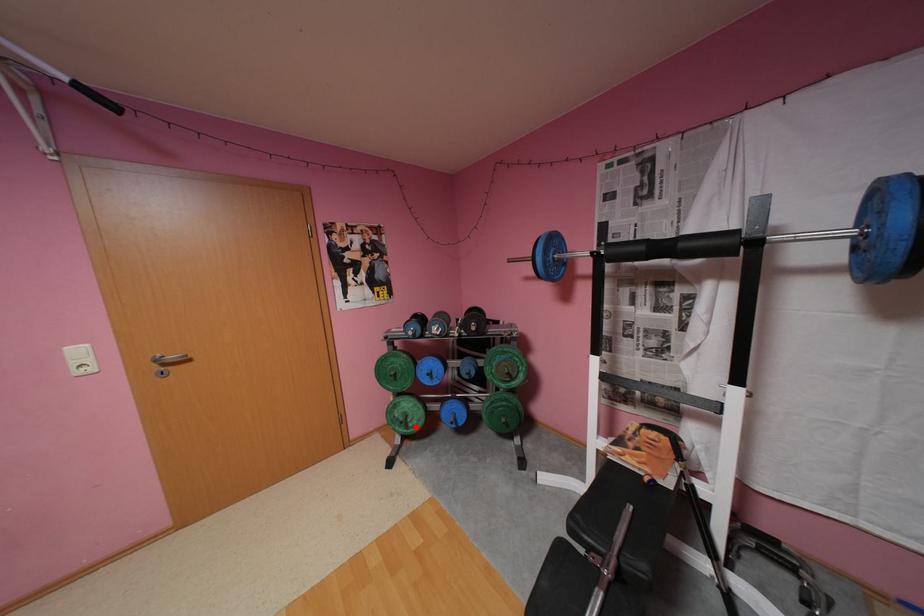
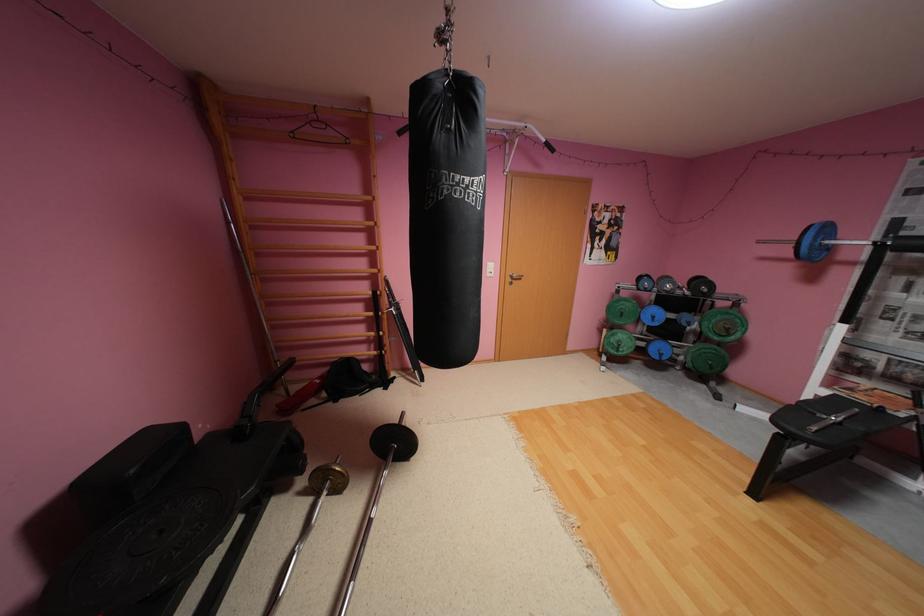
Question: I am providing you with two images of the same scene from different viewpoints. In image1, a red point is highlighted. Considering the same 3D point in image2, which of the following is correct?

Choices:
 (A) It is closer
 (B) It is farther

Answer: (A)